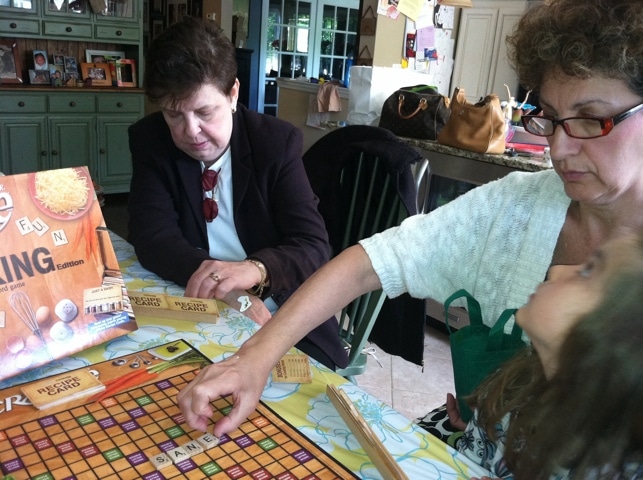
Where is `scrabble tiles`? Image resolution: width=643 pixels, height=480 pixels. scrabble tiles is located at coordinates (209, 443), (194, 445), (177, 457), (161, 461).